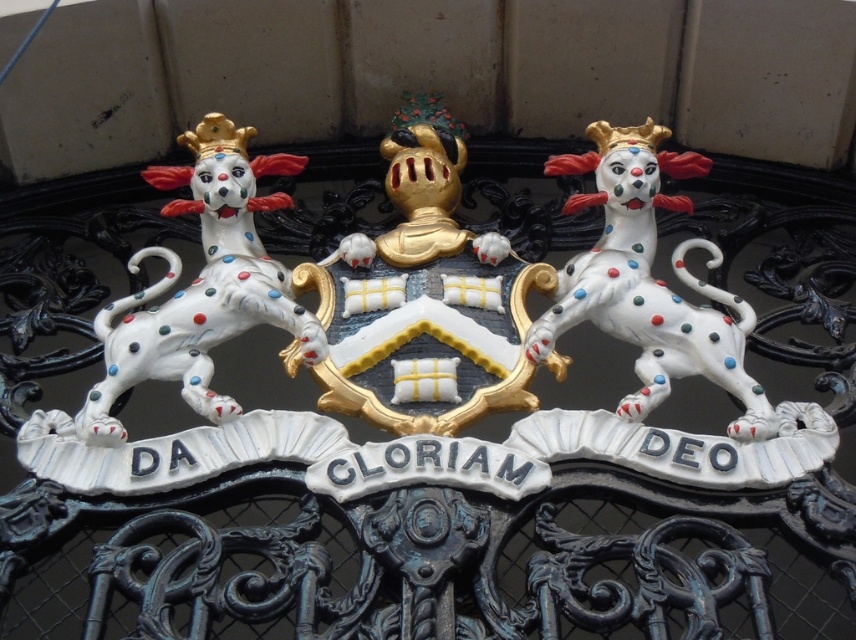
Is point (337, 392) closer to viewer compared to point (242, 134)?

Yes, it is in front of point (242, 134).

Is point (431, 282) farther from viewer compared to point (192, 193)?

That is False.

Locate an element on the screen. Image resolution: width=856 pixels, height=640 pixels. gold plated shield at center is located at coordinates (423, 296).

The height and width of the screenshot is (640, 856). Find the location of `gold plated shield at center`. gold plated shield at center is located at coordinates click(423, 296).

Is point (364, 298) behind point (727, 368)?

Yes, it is behind point (727, 368).

Between gold plated shield at center and polished ceramic dog at center, which one has less height?

polished ceramic dog at center

Who is more distant from viewer, (288, 371) or (581, 314)?

The point (581, 314) is more distant.

Find the location of a particular element. Image resolution: width=856 pixels, height=640 pixels. gold plated shield at center is located at coordinates (423, 296).

Describe the element at coordinates (201, 284) in the screenshot. I see `white glossy dog at upper left` at that location.

Can you confirm if white glossy dog at upper left is bigger than polished ceramic dog at center?

Correct, white glossy dog at upper left is larger in size than polished ceramic dog at center.

Between point (253, 260) and point (654, 173), which one is positioned in front?

Positioned in front is point (253, 260).

The image size is (856, 640). I want to click on white glossy dog at upper left, so click(201, 284).